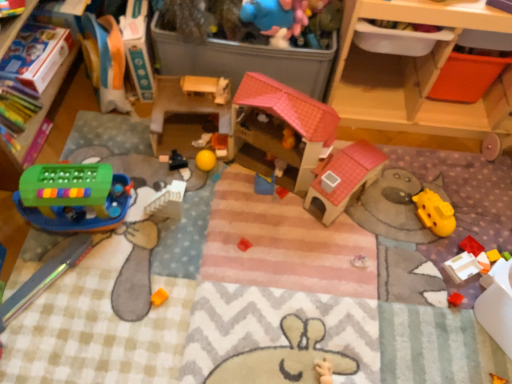
Identify the location of vacant space that's between yellow rubber ball at center, which is counted as the 4th toy, starting from the right, and white plastic block at lower right, acting as the eighth toy starting from the left. (357, 222).